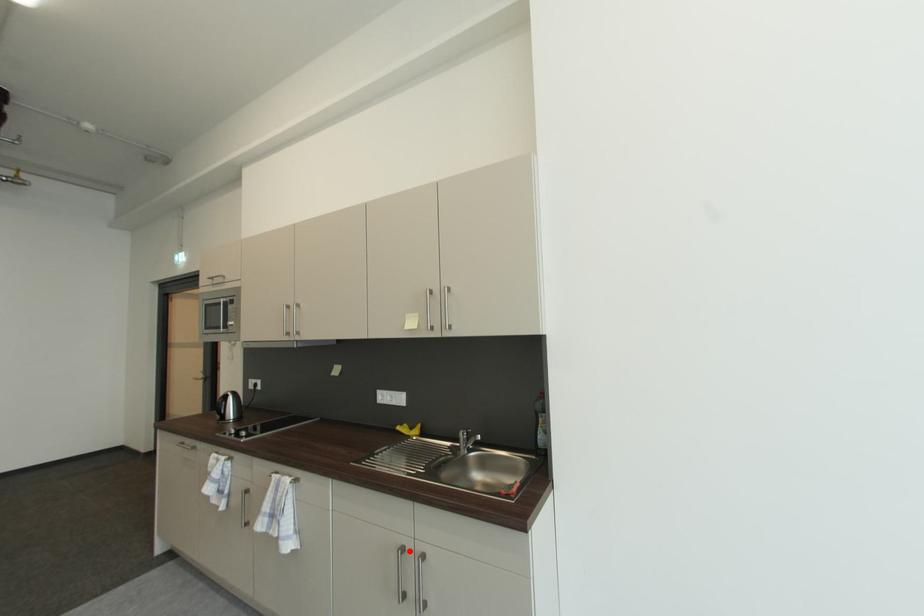
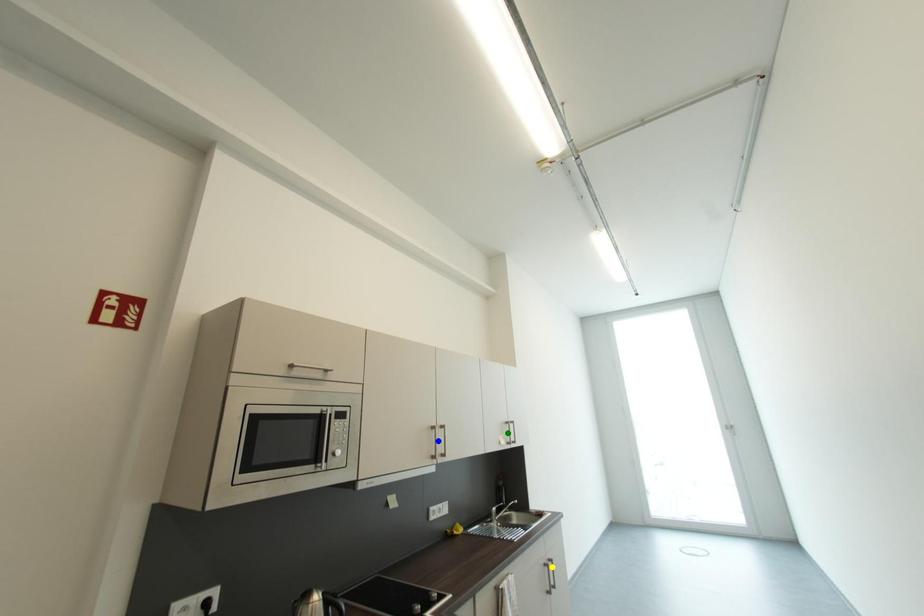
Question: I am providing you with two images of the same scene from different viewpoints. A red point is marked on the first image. You are given multiple points on the second image. Which spot in image 2 lines up with the point in image 1?

Choices:
 (A) green point
 (B) blue point
 (C) yellow point

Answer: (C)